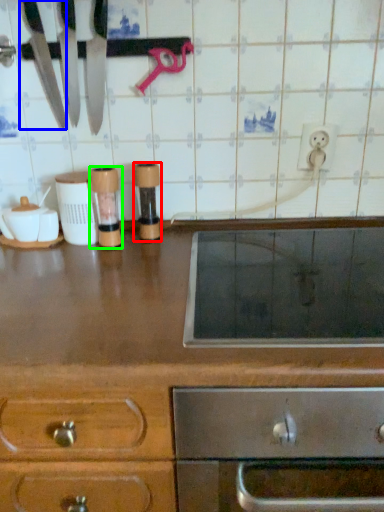
Question: Which is nearer to the appliance (highlighted by a red box)? knife (highlighted by a blue box) or appliance (highlighted by a green box).

Choices:
 (A) knife
 (B) appliance

Answer: (B)